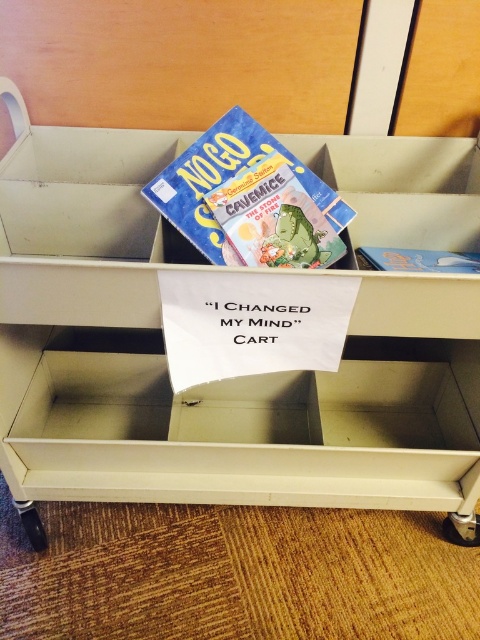
Between metallic silver wheel at lower right and black rubber wheel at lower left, which one is positioned lower?

metallic silver wheel at lower right is lower down.

Which is in front, point (460, 536) or point (35, 515)?

Point (35, 515) is in front.

This screenshot has height=640, width=480. What are the coordinates of `metallic silver wheel at lower right` in the screenshot? It's located at (462, 529).

Does matte cardboard drawer at upper center appear over metallic silver wheel at lower right?

Indeed, matte cardboard drawer at upper center is positioned over metallic silver wheel at lower right.

Does matte cardboard drawer at upper center appear on the right side of metallic silver wheel at lower right?

No, matte cardboard drawer at upper center is not to the right of metallic silver wheel at lower right.

Between point (441, 400) and point (444, 525), which one is positioned behind?

The point (441, 400) is more distant.

You are a GUI agent. You are given a task and a screenshot of the screen. Output one action in this format:
    pyautogui.click(x=<x>, y=<y>)
    Task: Click on the matte cardboard drawer at upper center
    This screenshot has width=480, height=640.
    Given the screenshot: What is the action you would take?
    pyautogui.click(x=217, y=381)

Is matte cardboard drawer at upper center taller than matte blue book at center?

Yes.

Is matte cardboard drawer at upper center shorter than matte blue book at center?

No.

Is point (368, 387) farther from viewer compared to point (224, 116)?

Yes, it is behind point (224, 116).

At what (x,y) coordinates should I click in order to perform the action: click on matte cardboard drawer at upper center. Please return your answer as a coordinate pair (x, y). Looking at the image, I should click on (217, 381).